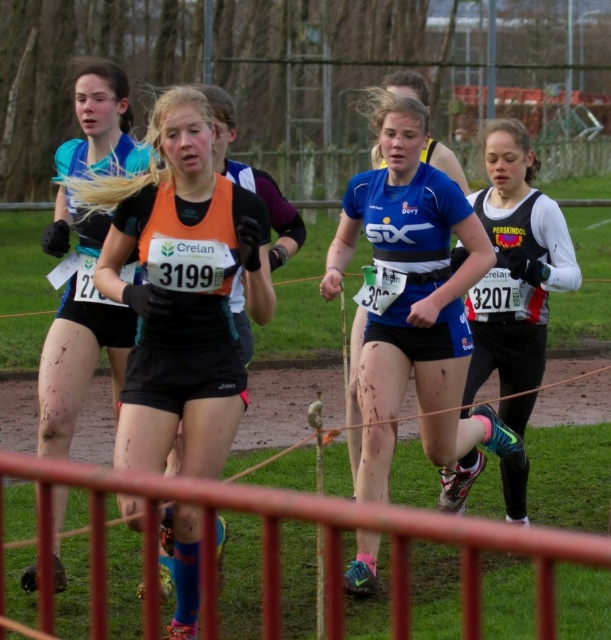
Which of these two, blue matte jersey at center or matte blue top at center, stands taller?

blue matte jersey at center

Does blue matte jersey at center have a smaller size compared to matte blue top at center?

Answer: Incorrect, blue matte jersey at center is not smaller in size than matte blue top at center.

Where is `blue matte jersey at center`? The width and height of the screenshot is (611, 640). blue matte jersey at center is located at coordinates [x=415, y=285].

Consider the image. Who is more forward, (137, 403) or (31, 588)?

Positioned in front is point (137, 403).

Between point (175, 324) and point (92, 260), which one is positioned in front?

Point (175, 324) is more forward.

I want to click on orange matte vest at center, so click(x=183, y=291).

This screenshot has height=640, width=611. I want to click on orange matte vest at center, so click(183, 291).

Is orange matte vest at center taller than black matte running suit at right?

Yes.

Which is in front, point (145, 300) or point (521, 355)?

Point (145, 300) is in front.

Identify the location of orange matte vest at center. (183, 291).